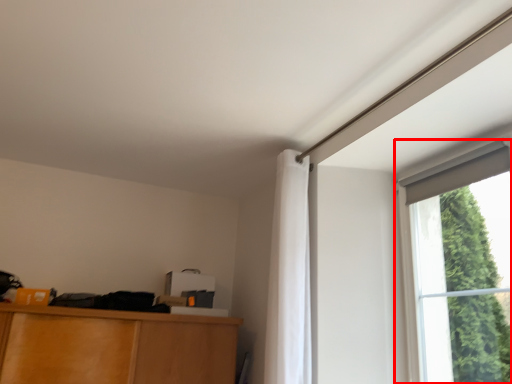
Question: From the image's perspective, considering the relative positions of window (annotated by the red box) and curtain in the image provided, where is window (annotated by the red box) located with respect to the staircase?

Choices:
 (A) below
 (B) above

Answer: (B)